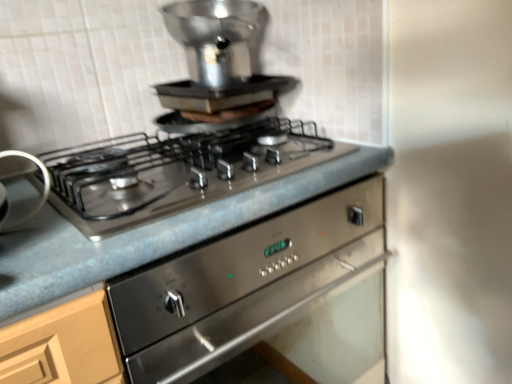
This screenshot has width=512, height=384. I want to click on free space in front of satin silver burner at left, which is the 2th appliance in back-to-front order, so click(37, 239).